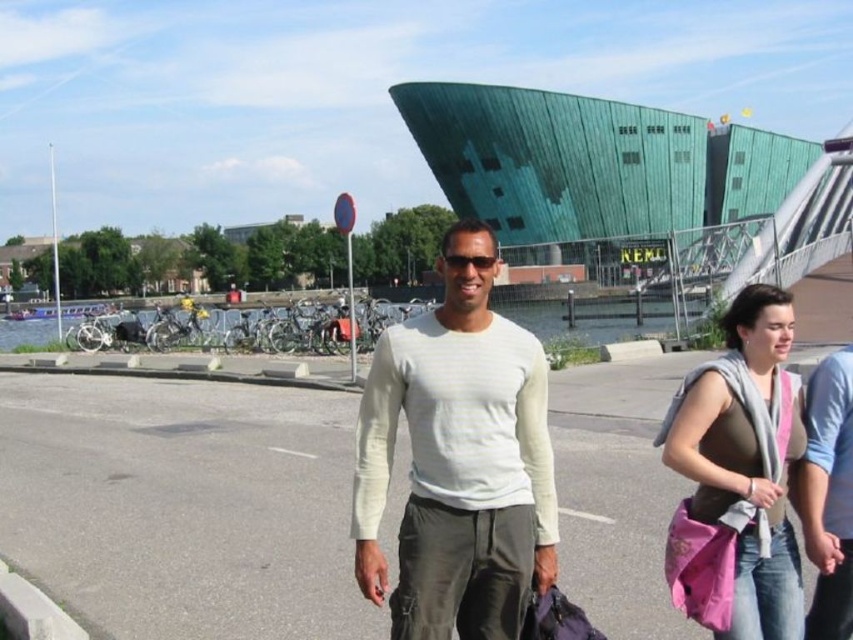
Question: Which is nearer to the green glass pedestrian bridge at upper center?

Choices:
 (A) sunglasses at center
 (B) pink fabric bag at lower right
 (C) white cotton shirt at center

Answer: (C)

Question: Which object is closer to the camera taking this photo?

Choices:
 (A) sunglasses at center
 (B) pink fabric bag at lower right

Answer: (B)

Question: Does pink fabric bag at lower right appear under sunglasses at center?

Choices:
 (A) yes
 (B) no

Answer: (A)

Question: Is green glass pedestrian bridge at upper center thinner than pink fabric bag at lower right?

Choices:
 (A) yes
 (B) no

Answer: (B)

Question: Does white cotton shirt at center have a smaller size compared to sunglasses at center?

Choices:
 (A) no
 (B) yes

Answer: (A)

Question: Which point is farther to the camera?

Choices:
 (A) green glass pedestrian bridge at upper center
 (B) pink fabric bag at lower right
 (C) sunglasses at center
 (D) white cotton shirt at center

Answer: (A)